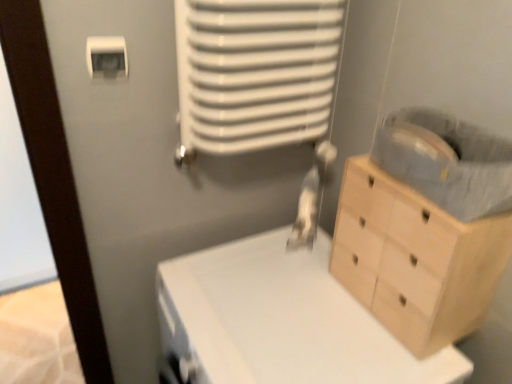
Identify the location of free space to the left of light wood chest of drawers at right. The width and height of the screenshot is (512, 384). (301, 308).